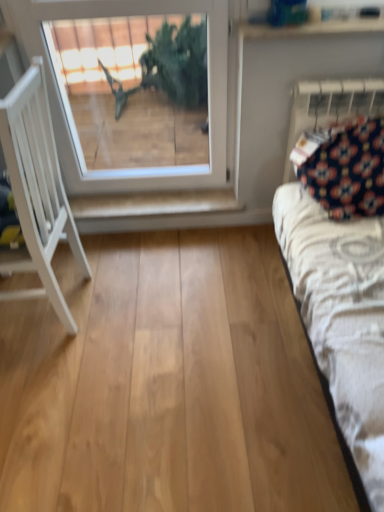
I want to click on vacant space underneath white wood chair at left (from a real-world perspective), so click(43, 300).